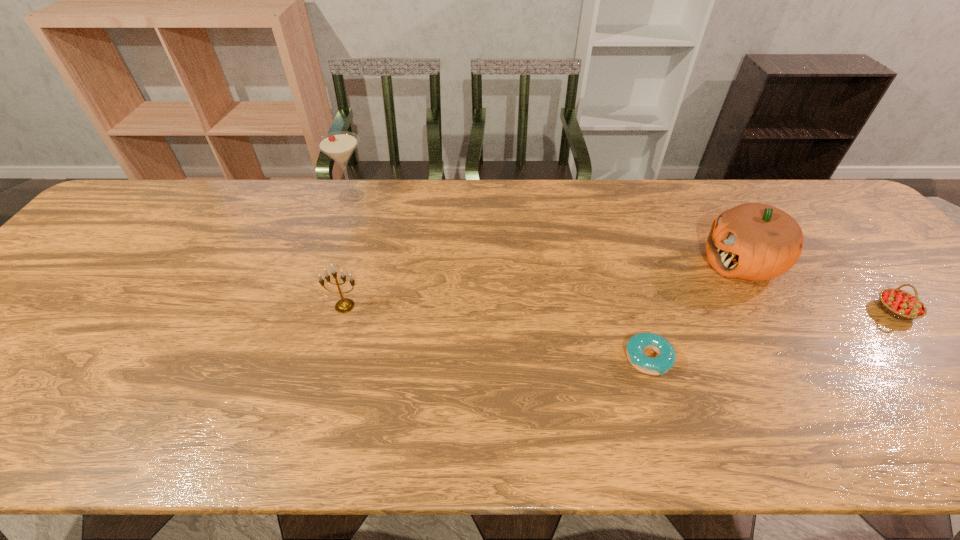
Find the location of `free region at the right edge of the desktop`. free region at the right edge of the desktop is located at coordinates (866, 272).

Identify the location of free region at the far left corner of the desktop. (126, 222).

The width and height of the screenshot is (960, 540). I want to click on free space between the pumpkin and the candelabrum, so click(543, 284).

The image size is (960, 540). What are the coordinates of `free spot between the nearest object and the second object from right to left` in the screenshot? It's located at (695, 310).

Where is `empty location between the fourth object from left to right and the martini`? This screenshot has height=540, width=960. empty location between the fourth object from left to right and the martini is located at coordinates (546, 230).

Image resolution: width=960 pixels, height=540 pixels. What are the coordinates of `vacant space that's between the rightmost object and the second farthest object` in the screenshot? It's located at point(819,286).

Identify the location of free area in between the candelabrum and the fourth object from left to right. (543, 284).

I want to click on empty space that is in between the second object from right to left and the rightmost object, so click(x=819, y=286).

The width and height of the screenshot is (960, 540). Find the location of `free spot between the second object from right to left and the shortest object`. free spot between the second object from right to left and the shortest object is located at coordinates (695, 310).

The height and width of the screenshot is (540, 960). I want to click on vacant area that lies between the pumpkin and the third object from right to left, so click(695, 310).